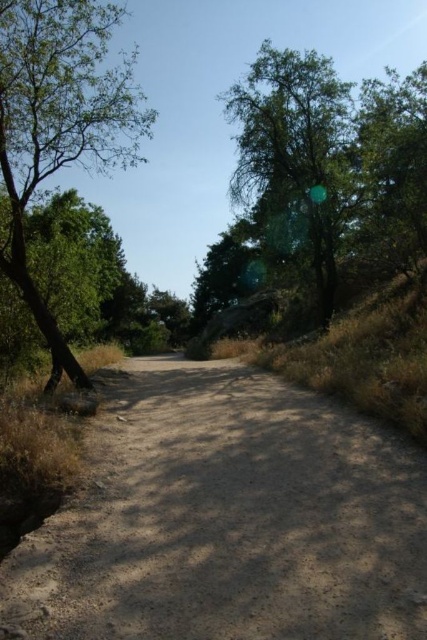
You are a hiker walking along the path and want to rest under the shade. Which object between the dusty brown dirt track at center and the green leafy tree at upper right would provide more shade?

The green leafy tree at upper right provides more shade because it is taller and has a denser canopy than the dusty brown dirt track at center, which is just a path.

You are a hiker standing on the dirt path and want to take a photo of both the green leafy tree at upper right and the green leafy tree at left. Which tree should you position yourself closer to in order to capture both in a single frame?

You should position yourself closer to the green leafy tree at left because the green leafy tree at upper right is on its right side, allowing both trees to be included in the frame when moving towards the left tree.

You are standing at the starting point of your hike and see the dusty brown dirt track at center. If you follow the track straight ahead, will you encounter the tree with a slender trunk and sparse foliage on your left or right side?

The tree with a slender trunk and sparse foliage is on the left side of the dusty brown dirt track at center, so following the track straight ahead, you will see it on your left.